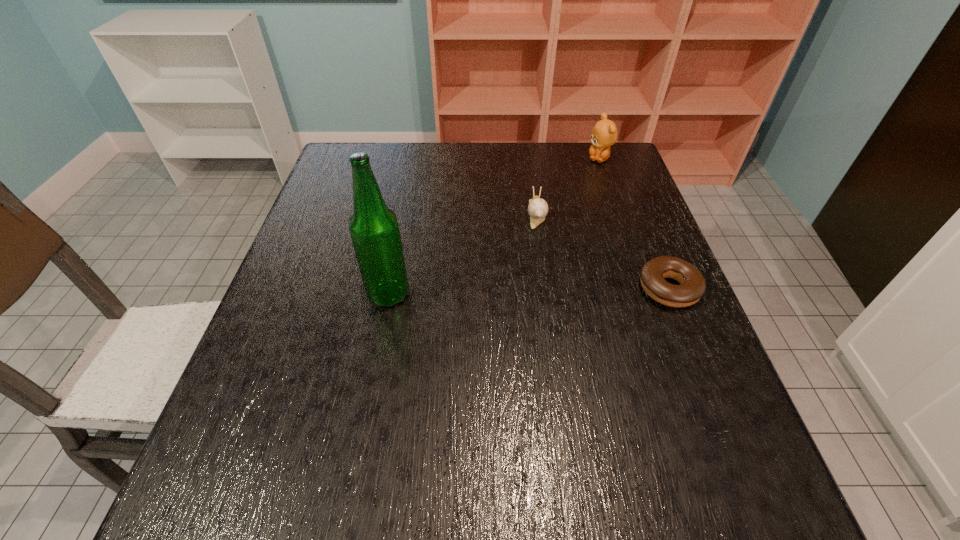
Identify the location of empty location between the beer bottle and the third object from right to left. This screenshot has width=960, height=540. (463, 254).

Find the location of a particular element. vacant area between the doughnut and the beer bottle is located at coordinates (529, 292).

Image resolution: width=960 pixels, height=540 pixels. Identify the location of free spot between the beer bottle and the second object from left to right. (463, 254).

Image resolution: width=960 pixels, height=540 pixels. Find the location of `free area in between the farthest object and the escargot`. free area in between the farthest object and the escargot is located at coordinates (567, 186).

Find the location of a particular element. The image size is (960, 540). free space between the doughnut and the tallest object is located at coordinates (529, 292).

Where is `vacant space in between the doughnut and the farthest object`? The image size is (960, 540). vacant space in between the doughnut and the farthest object is located at coordinates (634, 224).

Find the location of `object that is the third closest to the doughnut`. object that is the third closest to the doughnut is located at coordinates (374, 229).

Find the location of a particular element. the second closest object to the doughnut is located at coordinates (604, 134).